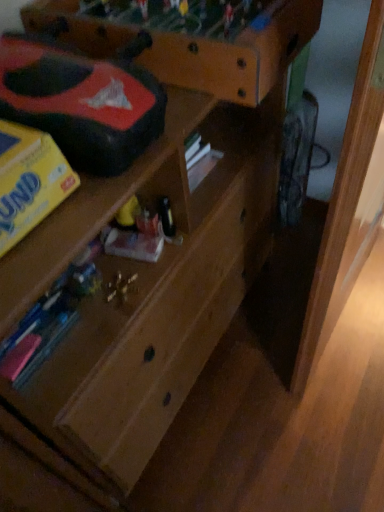
In the scene shown: What is the approximate width of wooden shelf at upper center?

It is 20.39 inches.

Identify the location of wooden shelf at upper center. The width and height of the screenshot is (384, 512). (191, 39).

Describe the element at coordinates (191, 39) in the screenshot. I see `wooden shelf at upper center` at that location.

Measure the distance between rubberized black toy car at upper left and camera.

They are 22.13 inches apart.

What do you see at coordinates (81, 102) in the screenshot? The width and height of the screenshot is (384, 512). I see `rubberized black toy car at upper left` at bounding box center [81, 102].

Where is `rubberized black toy car at upper left`? The width and height of the screenshot is (384, 512). rubberized black toy car at upper left is located at coordinates (81, 102).

I want to click on wooden shelf at upper center, so click(x=191, y=39).

Between rubberized black toy car at upper left and wooden shelf at upper center, which one appears on the right side from the viewer's perspective?

From the viewer's perspective, wooden shelf at upper center appears more on the right side.

Is rubberized black toy car at upper left closer to camera compared to wooden shelf at upper center?

Yes, rubberized black toy car at upper left is in front of wooden shelf at upper center.

Does point (75, 114) come behind point (221, 34)?

No, it is in front of (221, 34).

Consider the image. From the image's perspective, which one is positioned higher, rubberized black toy car at upper left or wooden shelf at upper center?

wooden shelf at upper center is shown above in the image.

From the picture: From a real-world perspective, which is physically below, rubberized black toy car at upper left or wooden shelf at upper center?

wooden shelf at upper center, from a real-world perspective.

Considering the sizes of rubberized black toy car at upper left and wooden shelf at upper center in the image, is rubberized black toy car at upper left wider or thinner than wooden shelf at upper center?

In the image, rubberized black toy car at upper left appears to be more narrow than wooden shelf at upper center.

From their relative heights in the image, would you say rubberized black toy car at upper left is taller or shorter than wooden shelf at upper center?

rubberized black toy car at upper left is shorter than wooden shelf at upper center.

Who is bigger, rubberized black toy car at upper left or wooden shelf at upper center?

Bigger between the two is wooden shelf at upper center.

Choose the correct answer: Is rubberized black toy car at upper left inside wooden shelf at upper center or outside it?

rubberized black toy car at upper left is located beyond the bounds of wooden shelf at upper center.

Are rubberized black toy car at upper left and wooden shelf at upper center located far from each other?

No, rubberized black toy car at upper left is in close proximity to wooden shelf at upper center.

Is rubberized black toy car at upper left facing away from wooden shelf at upper center?

No, rubberized black toy car at upper left is not facing away from wooden shelf at upper center.

Locate an element on the screen. shelf that is behind the rubberized black toy car at upper left is located at coordinates (191, 39).

In the scene shown: Is wooden shelf at upper center to the left or to the right of rubberized black toy car at upper left in the image?

From the image, it's evident that wooden shelf at upper center is to the right of rubberized black toy car at upper left.

In the scene shown: Between wooden shelf at upper center and rubberized black toy car at upper left, which one is positioned behind?

wooden shelf at upper center is further away from the camera.

Is point (47, 24) in front of point (7, 72)?

That is False.

From the image's perspective, is wooden shelf at upper center on top of rubberized black toy car at upper left?

Yes, from the image's perspective, wooden shelf at upper center is on top of rubberized black toy car at upper left.

From a real-world perspective, does wooden shelf at upper center sit lower than rubberized black toy car at upper left?

Correct, in the physical world, wooden shelf at upper center is lower than rubberized black toy car at upper left.

Does wooden shelf at upper center have a greater width compared to rubberized black toy car at upper left?

Yes.

Who is taller, wooden shelf at upper center or rubberized black toy car at upper left?

With more height is wooden shelf at upper center.

Looking at the image, does wooden shelf at upper center seem bigger or smaller compared to rubberized black toy car at upper left?

Considering their sizes, wooden shelf at upper center takes up more space than rubberized black toy car at upper left.

Is rubberized black toy car at upper left located within wooden shelf at upper center?

No, rubberized black toy car at upper left is located outside of wooden shelf at upper center.

Would you consider wooden shelf at upper center to be distant from rubberized black toy car at upper left?

No, there isn't a large distance between wooden shelf at upper center and rubberized black toy car at upper left.

Is wooden shelf at upper center oriented away from rubberized black toy car at upper left?

wooden shelf at upper center does not have its back to rubberized black toy car at upper left.

This screenshot has height=512, width=384. In order to click on shelf below the rubberized black toy car at upper left (from a real-world perspective) in this screenshot , I will do `click(191, 39)`.

Find the location of a particular element. shelf located on the right of rubberized black toy car at upper left is located at coordinates (191, 39).

This screenshot has height=512, width=384. I want to click on toy car above the wooden shelf at upper center (from a real-world perspective), so click(x=81, y=102).